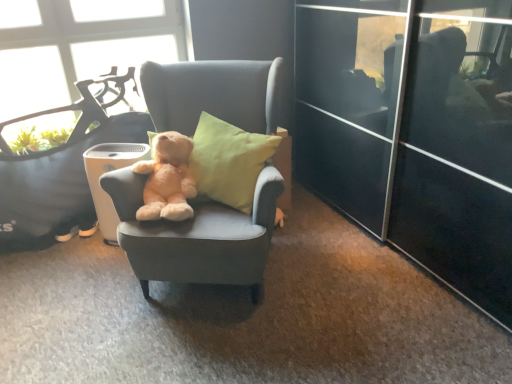
Question: Should I look upward or downward to see white plastic trash bin/can at center?

Choices:
 (A) up
 (B) down

Answer: (B)

Question: Is soft gray fabric chair at center, the first chair when ordered from left to right, outside soft beige teddy bear at center?

Choices:
 (A) yes
 (B) no

Answer: (A)

Question: From the image's perspective, is soft gray fabric chair at center, which ranks as the second chair in right-to-left order, below soft beige teddy bear at center?

Choices:
 (A) no
 (B) yes

Answer: (A)

Question: Can you confirm if soft gray fabric chair at center, the first chair when ordered from left to right, is positioned to the right of soft beige teddy bear at center?

Choices:
 (A) yes
 (B) no

Answer: (B)

Question: Is soft gray fabric chair at center, the first chair when ordered from left to right, oriented away from soft beige teddy bear at center?

Choices:
 (A) yes
 (B) no

Answer: (B)

Question: Can you confirm if soft gray fabric chair at center, the first chair when ordered from left to right, is taller than soft beige teddy bear at center?

Choices:
 (A) yes
 (B) no

Answer: (A)

Question: Is soft gray fabric chair at center, the first chair when ordered from left to right, bigger than soft beige teddy bear at center?

Choices:
 (A) no
 (B) yes

Answer: (B)

Question: Is soft beige teddy bear at center in contact with transparent glass window at upper left?

Choices:
 (A) yes
 (B) no

Answer: (B)

Question: Is soft beige teddy bear at center aimed at transparent glass window at upper left?

Choices:
 (A) yes
 (B) no

Answer: (B)

Question: Is soft beige teddy bear at center facing away from transparent glass window at upper left?

Choices:
 (A) yes
 (B) no

Answer: (A)

Question: Can transparent glass window at upper left be found inside soft beige teddy bear at center?

Choices:
 (A) yes
 (B) no

Answer: (B)

Question: Is soft beige teddy bear at center closer to the viewer compared to transparent glass window at upper left?

Choices:
 (A) yes
 (B) no

Answer: (A)

Question: Considering the relative sizes of soft beige teddy bear at center and transparent glass window at upper left in the image provided, is soft beige teddy bear at center taller than transparent glass window at upper left?

Choices:
 (A) yes
 (B) no

Answer: (B)

Question: Could you tell me if soft beige teddy bear at center is facing soft gray fabric chair at center, which ranks as the second chair in right-to-left order?

Choices:
 (A) no
 (B) yes

Answer: (A)